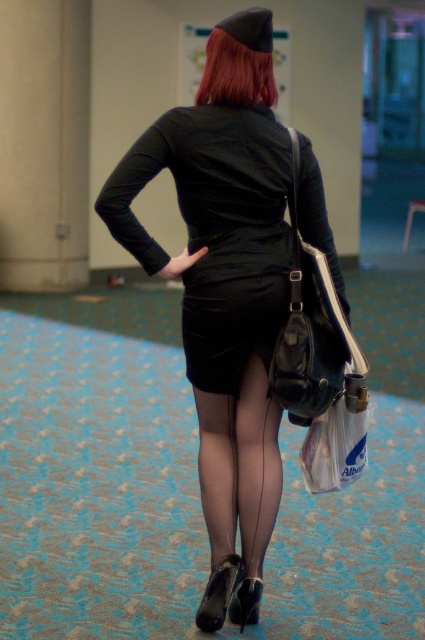
Question: Can you confirm if matte black dress at center is positioned above shiny red hair at upper center?

Choices:
 (A) no
 (B) yes

Answer: (A)

Question: Which of these objects is positioned closest to the matte black dress at center?

Choices:
 (A) black sheer tights at center
 (B) matte black bag at back
 (C) translucent plastic bag at lower center
 (D) shiny red hair at upper center

Answer: (A)

Question: Does matte black dress at center have a larger size compared to black satin dress at center?

Choices:
 (A) yes
 (B) no

Answer: (A)

Question: Which point is farther from the camera taking this photo?

Choices:
 (A) (345, 312)
 (B) (367, 406)
 (C) (206, 77)

Answer: (A)

Question: In this image, where is black sheer tights at center located relative to shiny red hair at upper center?

Choices:
 (A) below
 (B) above

Answer: (A)

Question: Which point is closer to the camera?

Choices:
 (A) black sheer tights at center
 (B) shiny red hair at upper center
 (C) matte black dress at center
 (D) black satin dress at center

Answer: (C)